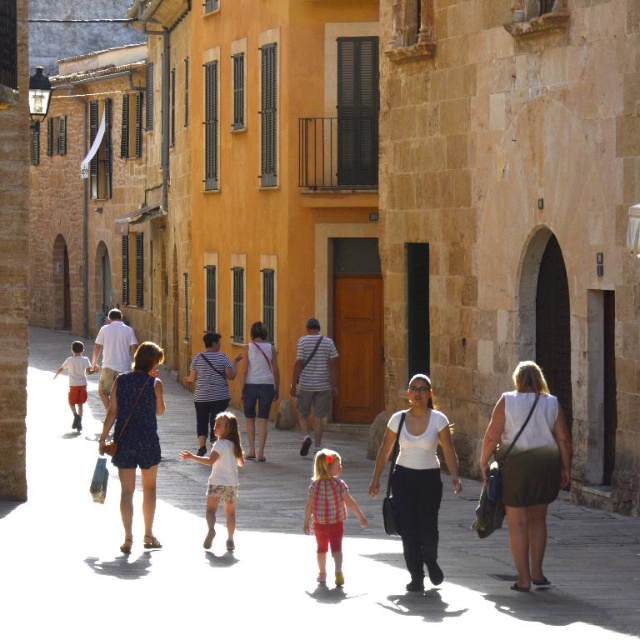
Is matte white people at center further to the viewer compared to white cotton shirt at center?

No, matte white people at center is closer to the viewer.

This screenshot has width=640, height=640. Find the location of `matte white people at center`. matte white people at center is located at coordinates (275, 552).

Which is in front, point (115, 513) or point (72, 380)?

Point (115, 513)

Is matte white people at center taller than orange cotton shorts at left?

In fact, matte white people at center may be shorter than orange cotton shorts at left.

Is point (476, 493) behind point (81, 372)?

No.

Find the location of a particular element. This screenshot has height=640, width=640. matte white people at center is located at coordinates (275, 552).

From the picture: Does plaid fabric shirt at center have a lesser height compared to orange cotton shorts at left?

Yes, plaid fabric shirt at center is shorter than orange cotton shorts at left.

Locate an element on the screen. This screenshot has height=640, width=640. plaid fabric shirt at center is located at coordinates (328, 512).